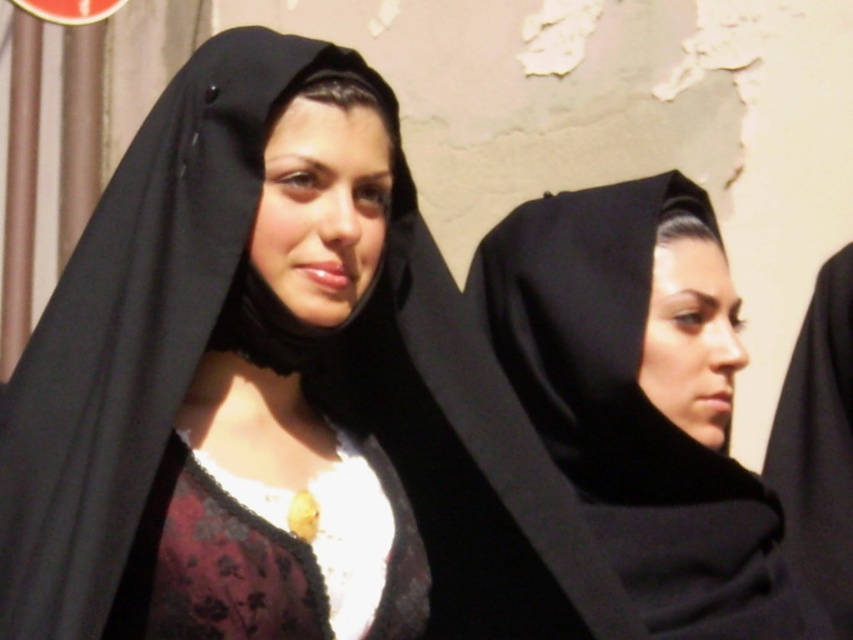
Consider the image. You are a photographer adjusting lighting for a photo shoot. You notice the matte black headscarf at center and the black matte robe at right. Which object requires more light to ensure its details are visible?

The matte black headscarf at center requires more light because it has a larger size compared to the black matte robe at right, making it harder to capture details in the soft lighting.